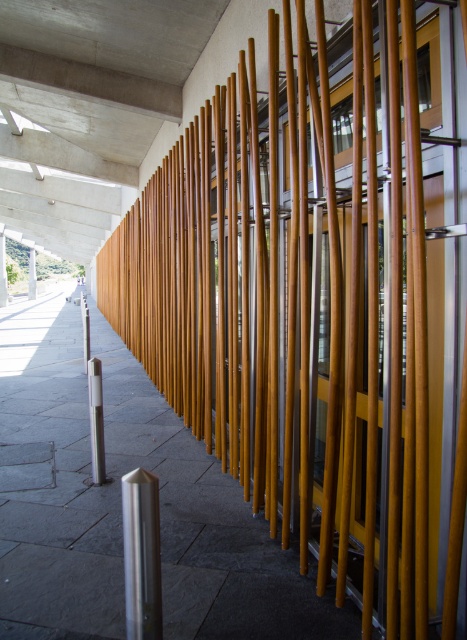
Identify the location of slate gray pavement at center. (120, 504).

Who is positioned more to the right, slate gray pavement at center or smooth concrete pillar at center?

slate gray pavement at center

Is point (220, 481) positioned behind point (35, 278)?

No, it is not.

I want to click on slate gray pavement at center, so click(120, 504).